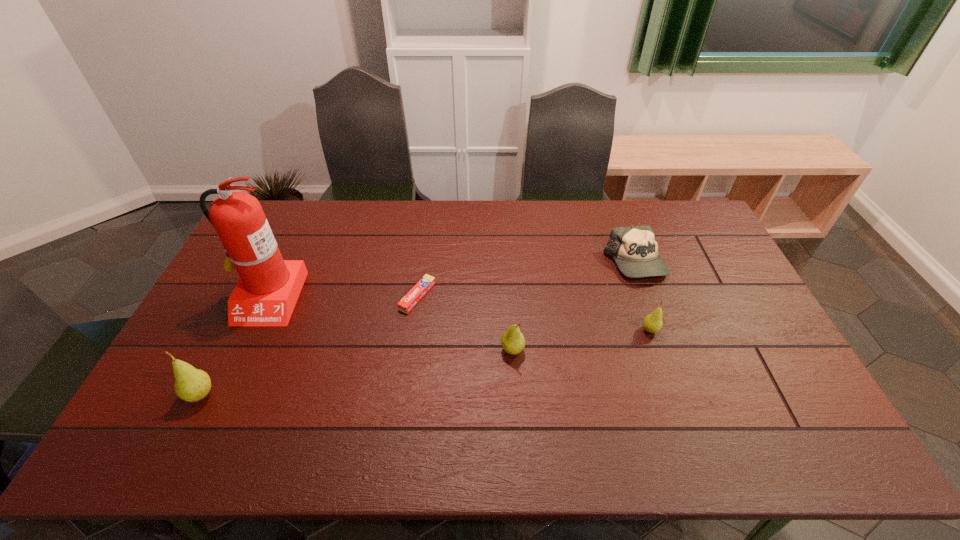
Identify the location of vacant area situated 0.350m on the right of the fifth shortest object. (353, 395).

This screenshot has width=960, height=540. In order to click on vacant region located on the back of the second farthest pear in this screenshot , I will do `click(506, 248)`.

Identify the location of vacant space located 0.230m on the left of the rightmost pear. (562, 330).

You are a GUI agent. You are given a task and a screenshot of the screen. Output one action in this format:
    pyautogui.click(x=<x>, y=<y>)
    Task: Click on the free location located on the front-facing side of the second shortest object
    The image size is (960, 540).
    Given the screenshot: What is the action you would take?
    pyautogui.click(x=669, y=357)

The width and height of the screenshot is (960, 540). Find the location of `vacant space located on the left of the toothpaste`. vacant space located on the left of the toothpaste is located at coordinates (333, 296).

This screenshot has height=540, width=960. I want to click on vacant space located 0.180m on the front-facing side of the fire extinguisher, so click(x=228, y=380).

At what (x,y) coordinates should I click in order to perform the action: click on object that is at the near edge. Please return your answer as a coordinate pair (x, y). This screenshot has height=540, width=960. Looking at the image, I should click on (191, 384).

Where is `pear located in the left edge section of the desktop`? This screenshot has height=540, width=960. pear located in the left edge section of the desktop is located at coordinates (191, 384).

The width and height of the screenshot is (960, 540). In order to click on fire extinguisher present at the left edge in this screenshot , I will do `click(265, 295)`.

I want to click on object that is positioned at the near left corner, so click(x=191, y=384).